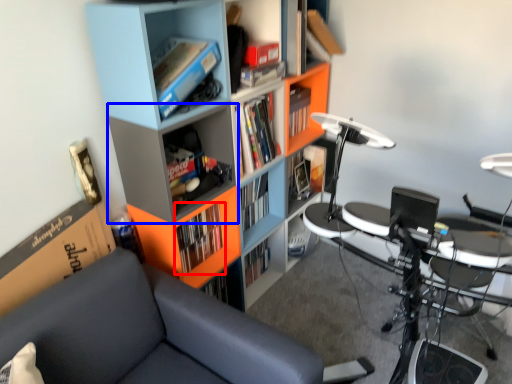
Question: Which of the following is the farthest to the observer, book (highlighted by a red box) or shelf (highlighted by a blue box)?

Choices:
 (A) book
 (B) shelf

Answer: (A)